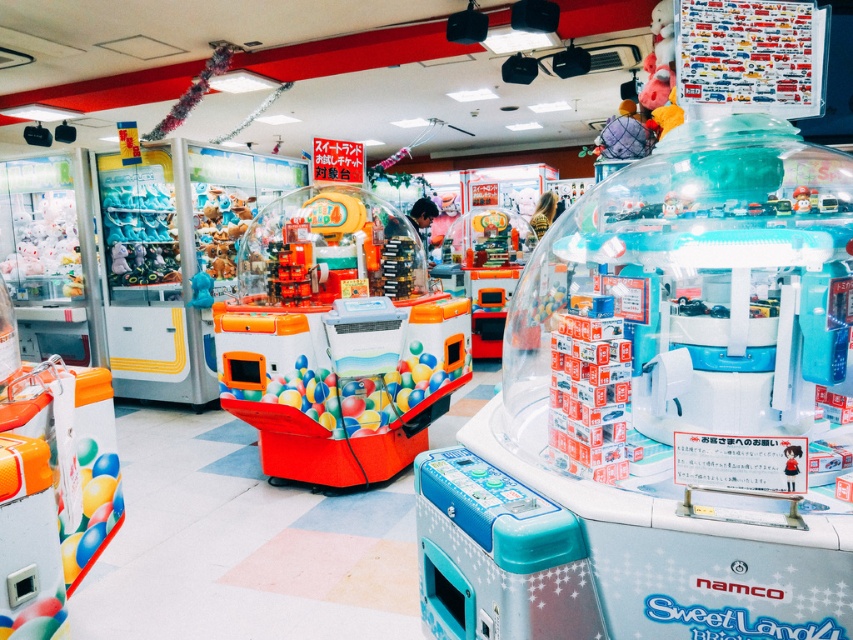
You are a child trying to grab the orange matte toy at center from the orange glossy claw machine at center. Can you reach the toy with the claw?

The orange glossy claw machine at center is located above the orange matte toy at center, so yes, the claw can reach the toy since it is positioned above it.

You are standing in the arcade and want to reach both points, point (315, 301) and point (592, 465). Which point is closer to you?

Point (315, 301) is closer to you because it is further to the camera than point (592, 465).